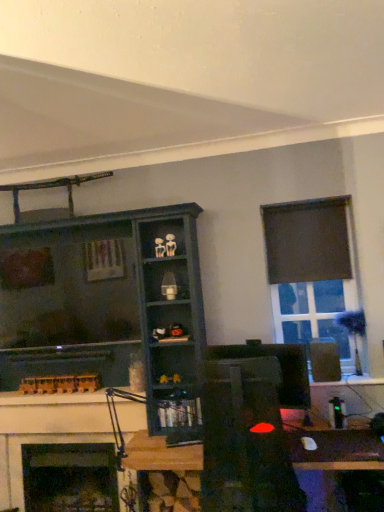
Locate an element on the screen. The width and height of the screenshot is (384, 512). vacant point above white painted wood fireplace at lower left (from a real-world perspective) is located at coordinates (54, 403).